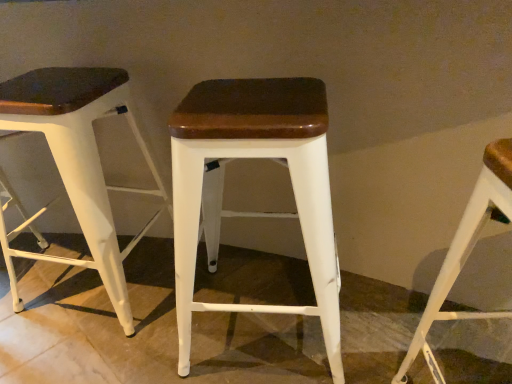
At what (x,y) coordinates should I click in order to perform the action: click on blank space situated above white matte wood stool at center, the 3th stool viewed from the right (from a real-world perspective). Please return your answer as a coordinate pair (x, y). The width and height of the screenshot is (512, 384). Looking at the image, I should click on (51, 82).